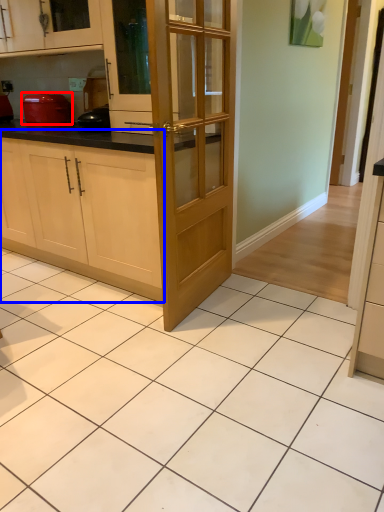
Question: Among these objects, which one is farthest to the camera, kitchen appliance (highlighted by a red box) or cabinetry (highlighted by a blue box)?

Choices:
 (A) kitchen appliance
 (B) cabinetry

Answer: (A)